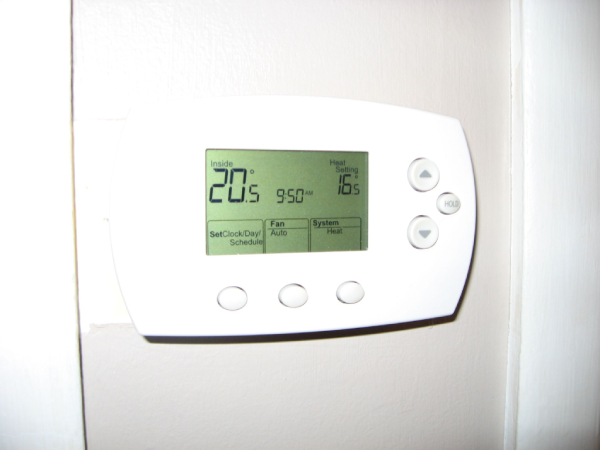
I want to click on wall, so click(x=346, y=398), click(x=322, y=35), click(x=496, y=225), click(x=99, y=264).